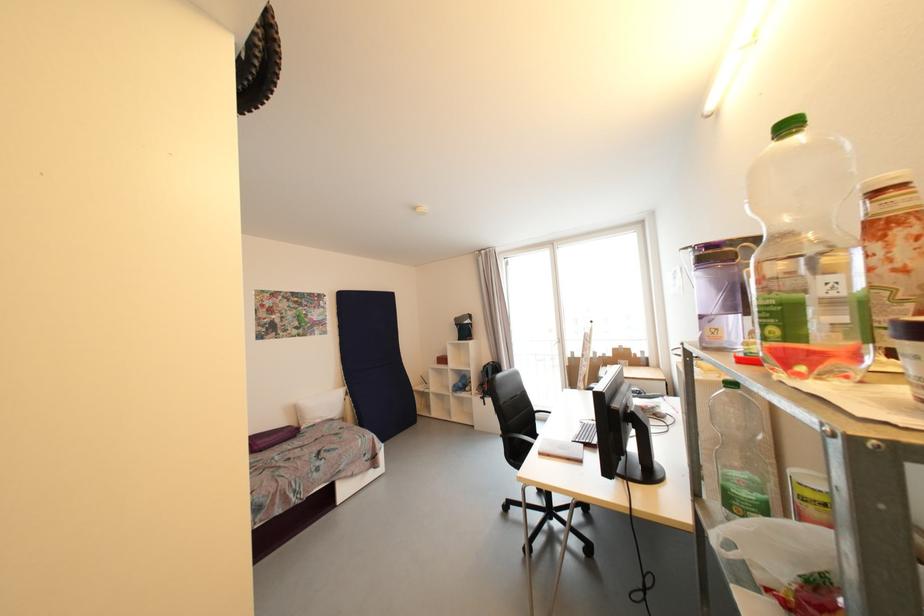
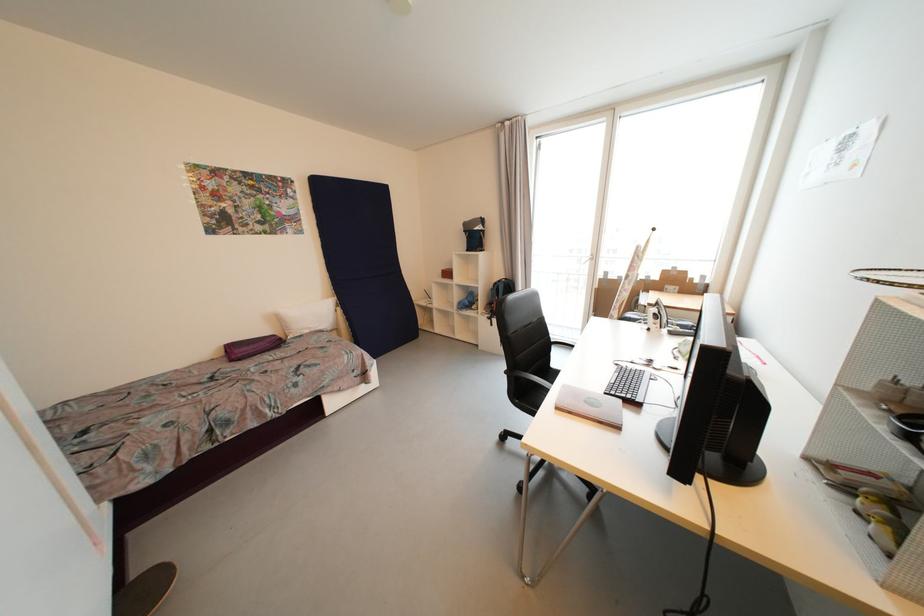
Question: How did the camera likely rotate?

Choices:
 (A) Left
 (B) Right
 (C) Up
 (D) Down

Answer: (D)